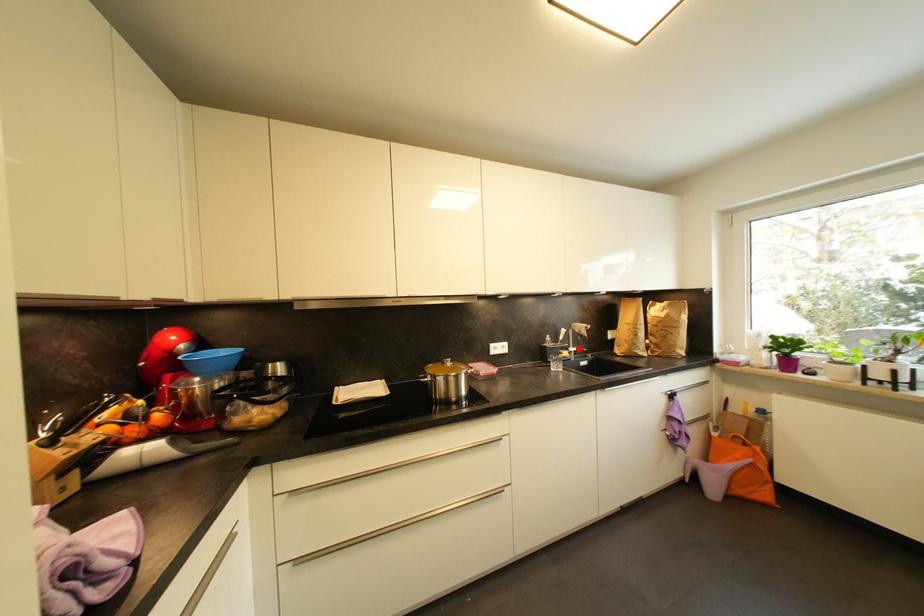
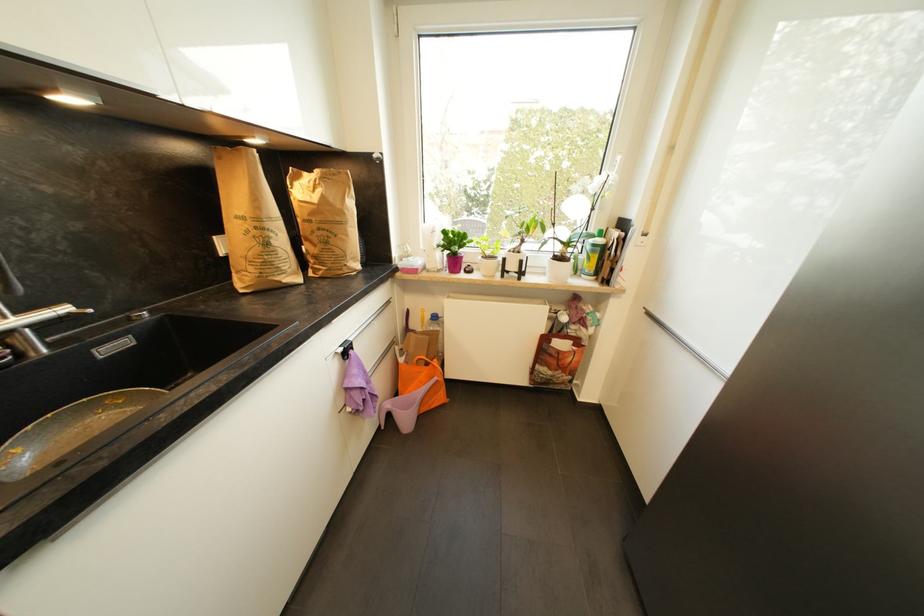
Locate, in the second image, the point that corresponds to the highlighted location in the first image.

(27, 313)